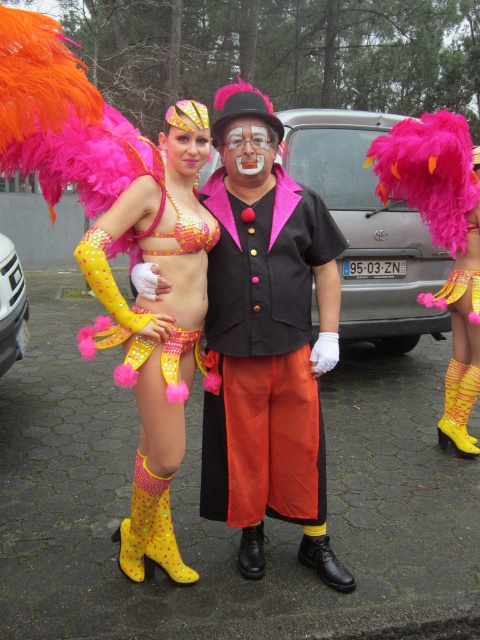
You are a costume designer assessing the spatial arrangement of the costumes in the image. Which object has a greater width between the matte yellow costume at center and the matte yellow sequined bikini top at center?

The matte yellow costume at center has a greater width than the matte yellow sequined bikini top at center according to the description.

You are a photographer trying to capture the matte yellow sequined bikini top at center in your shot. Based on its position coordinates, where exactly should you aim your camera?

The matte yellow sequined bikini top at center is located at point [156,324], so aim your camera at those coordinates to capture it.